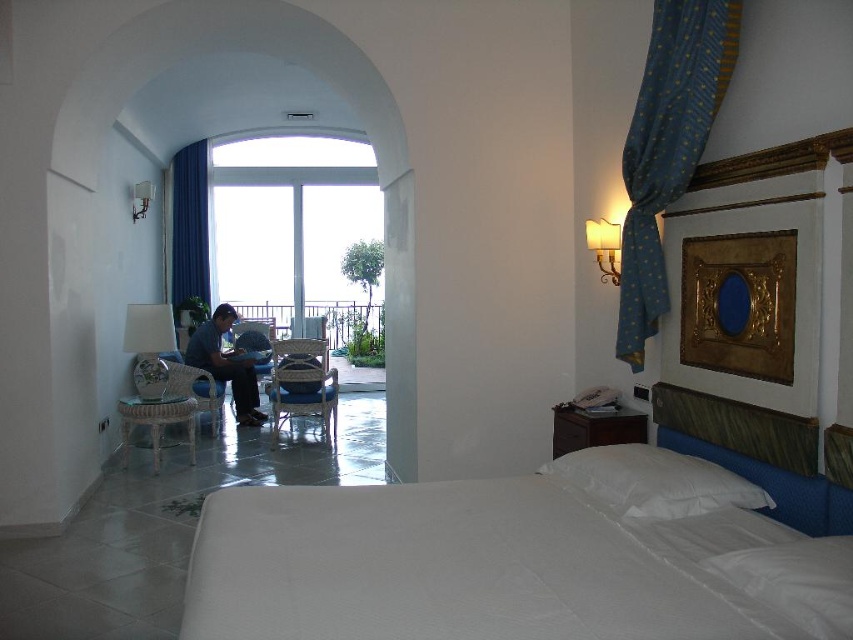
Who is positioned more to the right, wicker armchair at center or blue fabric armchair at center?

wicker armchair at center

Is point (303, 392) farther from camera compared to point (231, 328)?

No, it is not.

The width and height of the screenshot is (853, 640). Identify the location of wicker armchair at center. (302, 385).

Is point (718, 44) closer to camera compared to point (648, 477)?

No, (718, 44) is behind (648, 477).

Find the location of a particular element. The height and width of the screenshot is (640, 853). blue textured fabric at upper right is located at coordinates (666, 147).

Is blue fabric curtain at left above blue fabric armchair at center?

Yes.

Between blue fabric curtain at left and blue fabric armchair at center, which one has more height?

Standing taller between the two is blue fabric curtain at left.

Locate an element on the screen. Image resolution: width=853 pixels, height=640 pixels. blue fabric curtain at left is located at coordinates click(x=190, y=230).